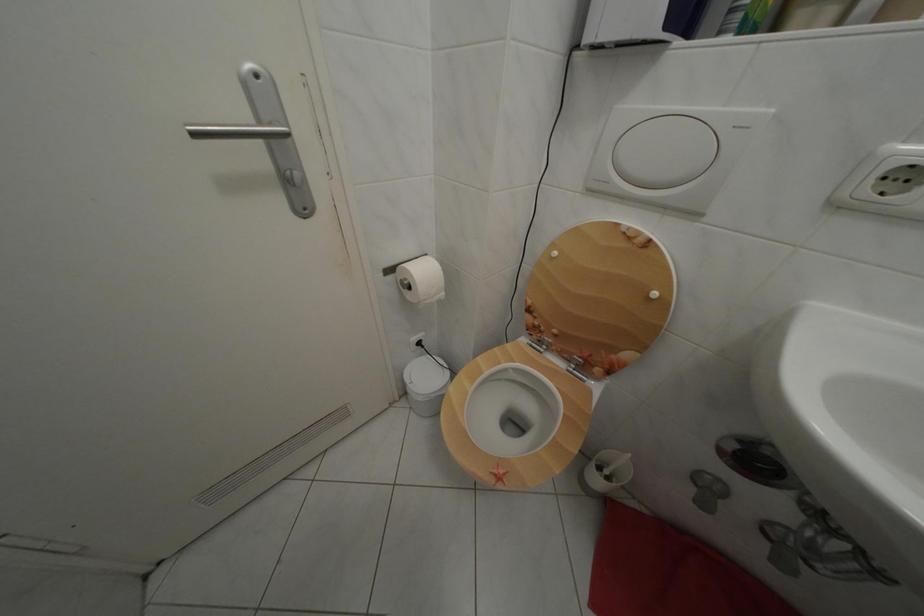
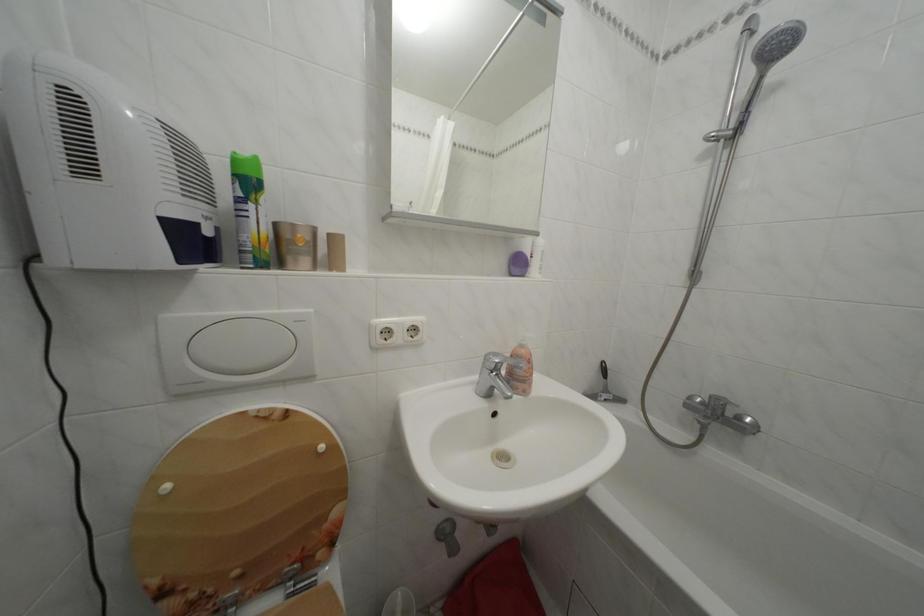
In the second image, find the point that corresponds to point (564, 259) in the first image.

(176, 493)